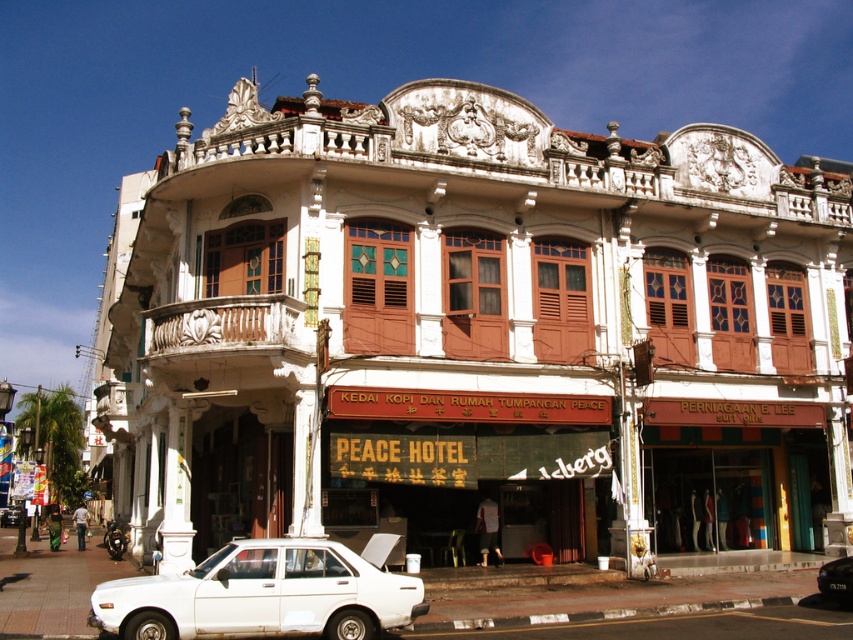
You are a delivery person who needs to park your vehicle in the parking lot near the white matte car at lower center and the white matte car at center. Which car should you park next to if you want to avoid blocking the entrance, considering the space between them?

The white matte car at lower center is thinner than the white matte car at center, so parking next to the white matte car at lower center would leave more space and avoid blocking the entrance.

You are a delivery person needing to park your motorcycle between the white matte sedan at center and the white matte car at center. What is the minimum distance you need to maintain between your motorcycle and each vehicle?

The white matte sedan at center and white matte car at center are 67.21 meters apart. To park your motorcycle between them, you must keep at least 33.605 meters distance from each vehicle.

You are a delivery driver who needs to park your white matte car at center in front of the white textured building at center. Is there enough space for your car to fit between the building and the road divider?

The white textured building at center might be wider than white matte car at center, so there might not be enough space for the car to fit between the building and the road divider.